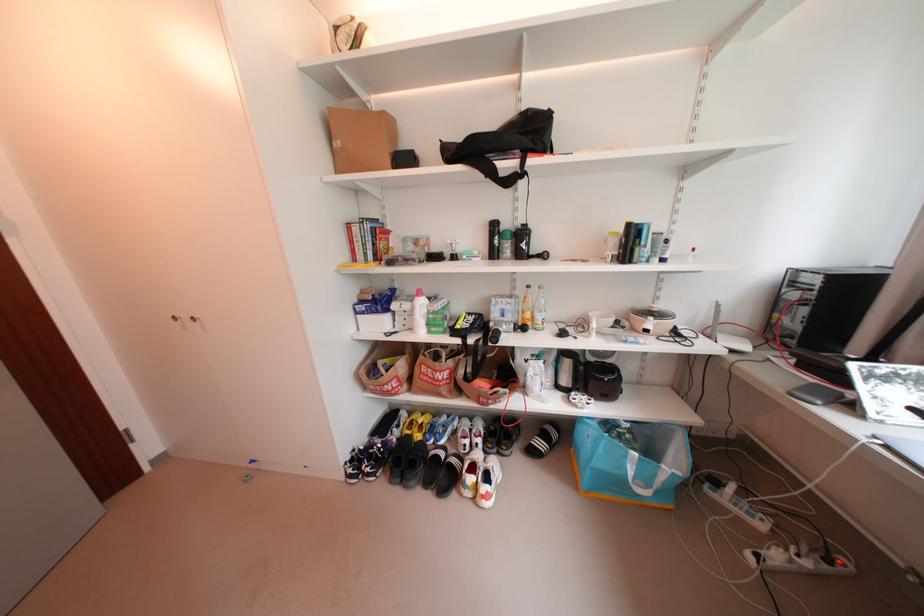
Locate an element on the screen. The height and width of the screenshot is (616, 924). brown cardboard box is located at coordinates (360, 139).